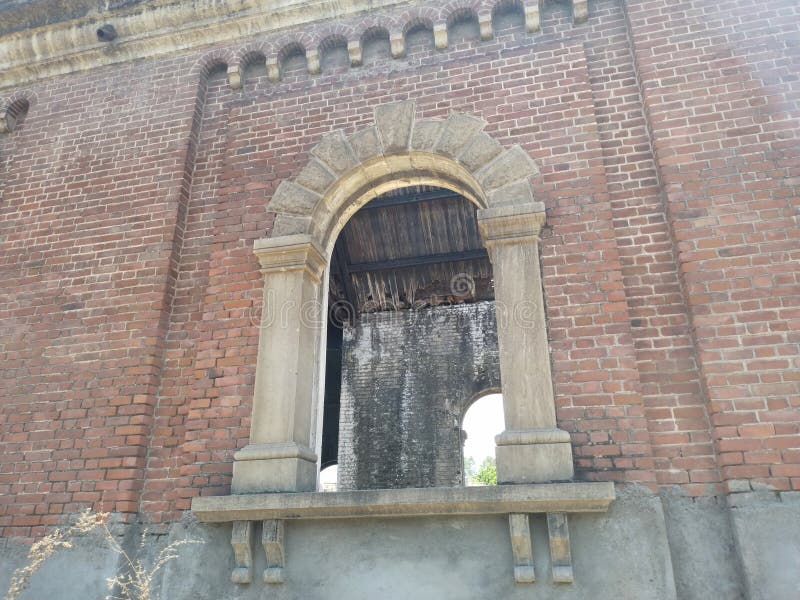
Identify the location of wall. (438, 366).